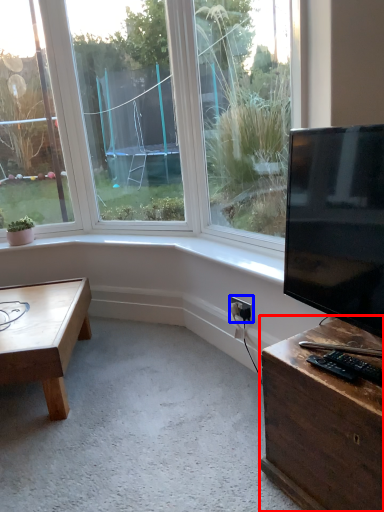
Question: Which object appears farthest to the camera in this image, desk (highlighted by a red box) or electric outlet (highlighted by a blue box)?

Choices:
 (A) desk
 (B) electric outlet

Answer: (B)